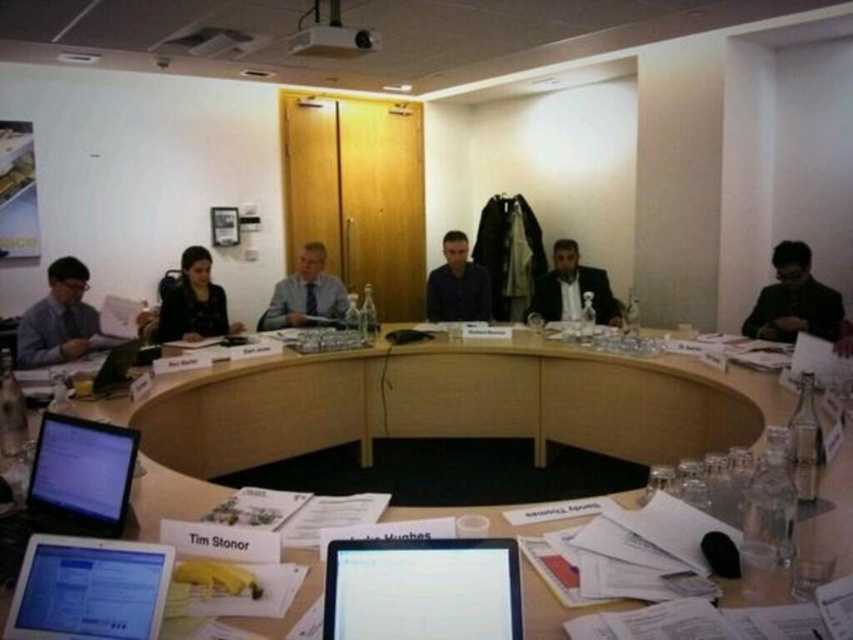
You are a guest entering the meeting room and see the matte black suit at left and the matte blue shirt at center. Which attendee has a narrower torso? Please answer based on the clothing details.

The matte black suit at left has a narrower torso than the matte blue shirt at center because it is thinner.

Based on the photo, you are a guest attending a meeting and need to place your briefcase on the table without blocking the white glossy laptop at center or the black suit at right. Based on their positions, where should you place your briefcase?

You should place your briefcase to the right of the black suit at right since the white glossy laptop at center is located to the left of the black suit at right, leaving space on its right side.